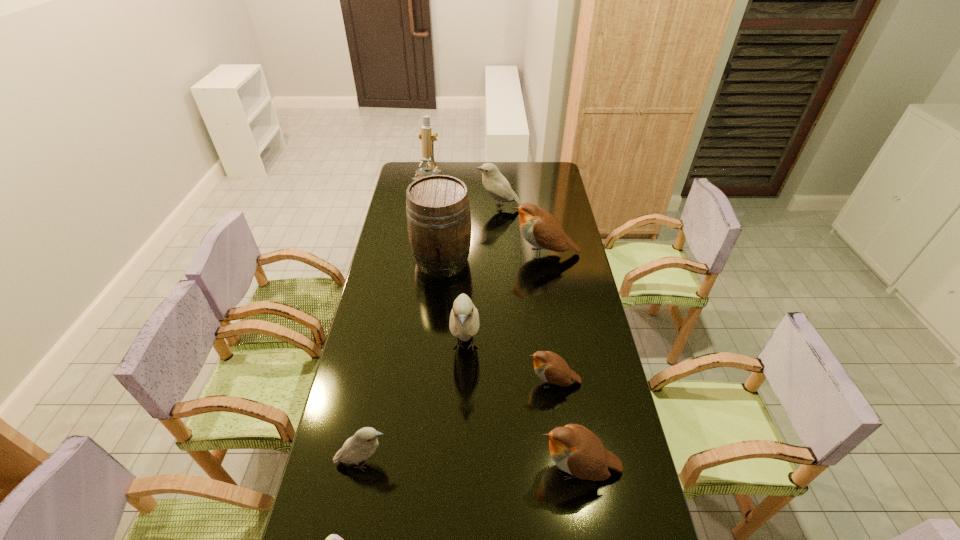
Identify the location of empty space that is in between the microscope and the farthest brown bird. The height and width of the screenshot is (540, 960). (487, 224).

Point out which object is positioned as the third nearest to the second nearest brown bird. Please provide its 2D coordinates. Your answer should be formatted as a tuple, i.e. [(x, y)], where the tuple contains the x and y coordinates of a point satisfying the conditions above.

[(364, 443)]

Find the location of a particular element. object that ranks as the fourth closest to the nearest brown bird is located at coordinates (333, 539).

Identify which bird is the closest to the cider. Please provide its 2D coordinates. Your answer should be formatted as a tuple, i.e. [(x, y)], where the tuple contains the x and y coordinates of a point satisfying the conditions above.

[(541, 229)]

I want to click on bird that is the fifth closest to the nearest white bird, so click(494, 182).

Identify which white bird is the nearest to the leftmost white bird. Please provide its 2D coordinates. Your answer should be formatted as a tuple, i.e. [(x, y)], where the tuple contains the x and y coordinates of a point satisfying the conditions above.

[(464, 319)]

Select which white bird appears as the second closest to the biggest brown bird. Please provide its 2D coordinates. Your answer should be formatted as a tuple, i.e. [(x, y)], where the tuple contains the x and y coordinates of a point satisfying the conditions above.

[(464, 319)]

Locate which brown bird is the third closest to the third tallest object. Please provide its 2D coordinates. Your answer should be formatted as a tuple, i.e. [(x, y)], where the tuple contains the x and y coordinates of a point satisfying the conditions above.

[(541, 229)]

The image size is (960, 540). Find the location of `brown bird object that ranks as the second closest to the biggest brown bird`. brown bird object that ranks as the second closest to the biggest brown bird is located at coordinates (576, 450).

Identify the location of vacant region that satisfies the following two spatial constraints: 1. at the face of the biggest brown bird; 2. at the beak of the seventh shortest object. The width and height of the screenshot is (960, 540). (561, 347).